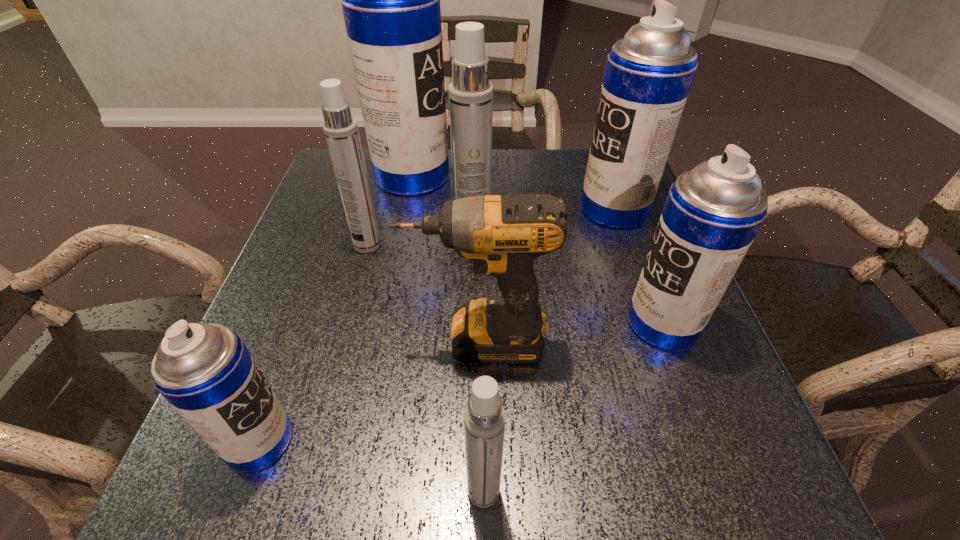
Locate an element on the screen. The height and width of the screenshot is (540, 960). the nearest white aerosol can is located at coordinates (484, 416).

Locate an element on the screen. the nearest aerosol can is located at coordinates [x=484, y=416].

Where is `vacant position located 0.360m on the label side of the second blue aerosol can from left to right`? The height and width of the screenshot is (540, 960). vacant position located 0.360m on the label side of the second blue aerosol can from left to right is located at coordinates (584, 177).

This screenshot has height=540, width=960. Find the location of `vacant region located 0.280m on the label side of the third smallest blue aerosol can`. vacant region located 0.280m on the label side of the third smallest blue aerosol can is located at coordinates [x=466, y=210].

Find the location of a particular element. This screenshot has height=540, width=960. free space located on the label side of the third smallest blue aerosol can is located at coordinates (511, 210).

Locate an element on the screen. This screenshot has height=540, width=960. free space located on the label side of the third smallest blue aerosol can is located at coordinates click(551, 210).

You are a GUI agent. You are given a task and a screenshot of the screen. Output one action in this format:
    pyautogui.click(x=<x>, y=<y>)
    Task: Click on the free space located on the front of the biggest white aerosol can
    
    Given the screenshot: What is the action you would take?
    pyautogui.click(x=470, y=386)

The width and height of the screenshot is (960, 540). Identify the location of vacant space situated on the back of the second biggest white aerosol can. (385, 181).

Where is `free space located on the label side of the second nearest blue aerosol can`? The height and width of the screenshot is (540, 960). free space located on the label side of the second nearest blue aerosol can is located at coordinates (601, 323).

At what (x,y) coordinates should I click in order to perform the action: click on blank space located 0.130m on the label side of the second nearest blue aerosol can. Please return your answer as a coordinate pair (x, y). The width and height of the screenshot is (960, 540). Looking at the image, I should click on (558, 323).